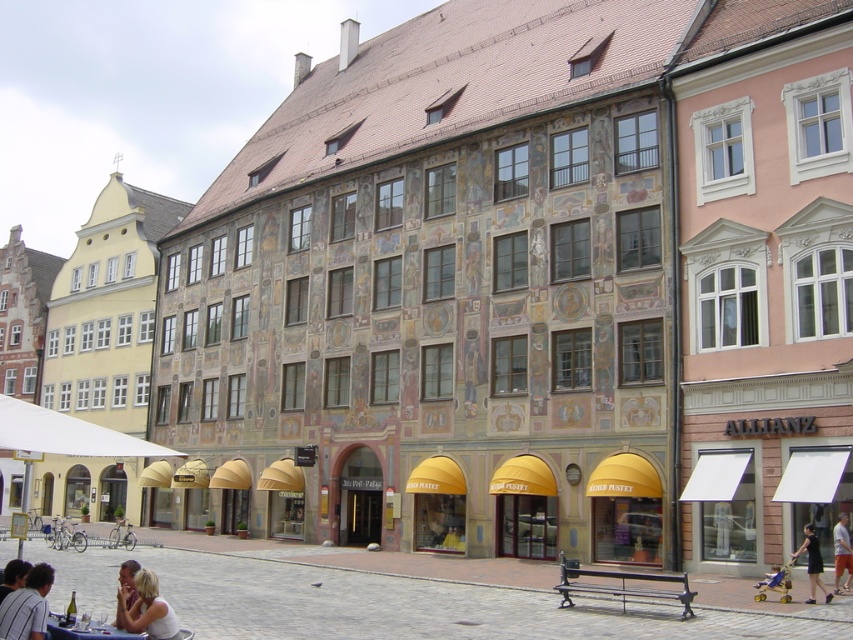
Question: Is light beige fabric dress at lower left behind smooth skin face at lower left?

Choices:
 (A) no
 (B) yes

Answer: (A)

Question: In this image, where is light beige fabric dress at lower left located relative to smooth skin face at lower left?

Choices:
 (A) below
 (B) above

Answer: (B)

Question: Which of the following is the farthest from the observer?

Choices:
 (A) dark blue shirt at lower left
 (B) black cotton shirt at lower right
 (C) light beige fabric dress at lower left

Answer: (B)

Question: Does light beige fabric dress at lower left have a smaller size compared to smooth skin face at lower left?

Choices:
 (A) no
 (B) yes

Answer: (B)

Question: Among these points, which one is farthest from the camera?

Choices:
 (A) [x=816, y=566]
 (B) [x=125, y=580]

Answer: (A)

Question: Which of the following is the closest to the observer?

Choices:
 (A) (15, 627)
 (B) (824, 588)
 (C) (137, 596)

Answer: (A)